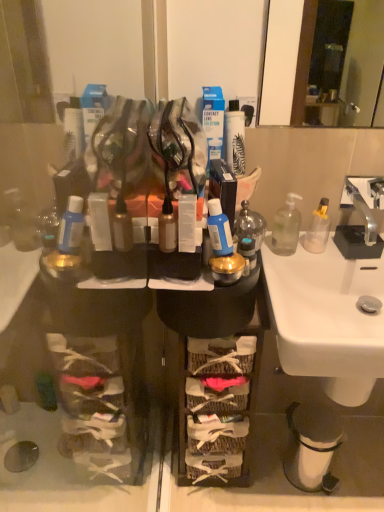
The height and width of the screenshot is (512, 384). What do you see at coordinates (318, 228) in the screenshot?
I see `clear plastic bottle at right, the third bottle positioned from the left` at bounding box center [318, 228].

What is the approximate height of translucent plastic bottle at center, the 3th toiletry in the left-to-right sequence?

The height of translucent plastic bottle at center, the 3th toiletry in the left-to-right sequence, is 7.49 centimeters.

The height and width of the screenshot is (512, 384). Describe the element at coordinates (286, 226) in the screenshot. I see `transparent glass soap dispenser at right, the 2th bottle in the left-to-right sequence` at that location.

The image size is (384, 512). In order to click on transparent glass soap dispenser at right, acting as the 2th bottle starting from the right in this screenshot , I will do `click(286, 226)`.

Image resolution: width=384 pixels, height=512 pixels. What do you see at coordinates (167, 227) in the screenshot?
I see `matte plastic container at center, the third toiletry in the right-to-left sequence` at bounding box center [167, 227].

What do you see at coordinates (362, 212) in the screenshot?
I see `silver metallic faucet at upper right` at bounding box center [362, 212].

Locate an element on the screen. This screenshot has height=512, width=384. clear plastic bottle at right, the 1th bottle from the right is located at coordinates (318, 228).

Between clear plastic bottle at right, the third bottle positioned from the left, and transparent glass soap dispenser at right, acting as the 2th bottle starting from the right, which one has larger width?

With larger width is transparent glass soap dispenser at right, acting as the 2th bottle starting from the right.

Would you say clear plastic bottle at right, the 1th bottle from the right, is outside transparent glass soap dispenser at right, the 2th bottle in the left-to-right sequence?

Yes, clear plastic bottle at right, the 1th bottle from the right, is not within transparent glass soap dispenser at right, the 2th bottle in the left-to-right sequence.

You are a GUI agent. You are given a task and a screenshot of the screen. Output one action in this format:
    pyautogui.click(x=<x>, y=<y>)
    Task: Click on the bottle on the right of transparent glass soap dispenser at right, acting as the 2th bottle starting from the right
    This screenshot has height=512, width=384.
    Given the screenshot: What is the action you would take?
    pyautogui.click(x=318, y=228)

Is blue matte bottle at center, which is counted as the 2th toiletry, starting from the right, a part of clear plastic bottle at right, the third bottle positioned from the left?

No, blue matte bottle at center, which is counted as the 2th toiletry, starting from the right, is located outside of clear plastic bottle at right, the third bottle positioned from the left.

From the image's perspective, is clear plastic bottle at right, the third bottle positioned from the left, below blue matte bottle at center, which is counted as the 2th toiletry, starting from the right?

No, from the image's perspective, clear plastic bottle at right, the third bottle positioned from the left, is not beneath blue matte bottle at center, which is counted as the 2th toiletry, starting from the right.

Is clear plastic bottle at right, the third bottle positioned from the left, in front of or behind blue matte bottle at center, which is counted as the 2th toiletry, starting from the right, in the image?

In the image, clear plastic bottle at right, the third bottle positioned from the left, appears behind blue matte bottle at center, which is counted as the 2th toiletry, starting from the right.

Looking at the image, does matte plastic container at center, arranged as the 1th toiletry when viewed from the left, seem bigger or smaller compared to translucent plastic bottle at center, positioned as the 1th toiletry in right-to-left order?

matte plastic container at center, arranged as the 1th toiletry when viewed from the left, is smaller than translucent plastic bottle at center, positioned as the 1th toiletry in right-to-left order.

In terms of height, does matte plastic container at center, arranged as the 1th toiletry when viewed from the left, look taller or shorter compared to translucent plastic bottle at center, positioned as the 1th toiletry in right-to-left order?

matte plastic container at center, arranged as the 1th toiletry when viewed from the left, is taller than translucent plastic bottle at center, positioned as the 1th toiletry in right-to-left order.

Is the position of matte plastic container at center, arranged as the 1th toiletry when viewed from the left, less distant than that of translucent plastic bottle at center, positioned as the 1th toiletry in right-to-left order?

That is True.

Does point (251, 243) appear closer or farther from the camera than point (355, 296)?

Point (251, 243) appears to be closer to the viewer than point (355, 296).

In terms of width, does translucent plastic bottle at center, the 3th toiletry in the left-to-right sequence, look wider or thinner when compared to white ceramic sink at lower right?

In the image, translucent plastic bottle at center, the 3th toiletry in the left-to-right sequence, appears to be more narrow than white ceramic sink at lower right.

Consider the image. From a real-world perspective, is translucent plastic bottle at center, the 3th toiletry in the left-to-right sequence, physically located above or below white ceramic sink at lower right?

From a real-world perspective, translucent plastic bottle at center, the 3th toiletry in the left-to-right sequence, is physically above white ceramic sink at lower right.

Is matte plastic container at center, the third toiletry in the right-to-left sequence, facing towards blue matte bottle at center, which ranks as the second toiletry in left-to-right order?

No, matte plastic container at center, the third toiletry in the right-to-left sequence, is not oriented towards blue matte bottle at center, which ranks as the second toiletry in left-to-right order.

Are matte plastic container at center, the third toiletry in the right-to-left sequence, and blue matte bottle at center, which ranks as the second toiletry in left-to-right order, making contact?

There is a gap between matte plastic container at center, the third toiletry in the right-to-left sequence, and blue matte bottle at center, which ranks as the second toiletry in left-to-right order.

Is point (165, 246) positioned behind point (208, 207)?

Yes, it is behind point (208, 207).

Is woven baskets at center next to silver metallic faucet at upper right?

No, woven baskets at center is not in contact with silver metallic faucet at upper right.

Based on the photo, is woven baskets at center positioned with its back to silver metallic faucet at upper right?

No.

From a real-world perspective, is woven baskets at center positioned above or below silver metallic faucet at upper right?

From a real-world perspective, woven baskets at center is physically below silver metallic faucet at upper right.

From the image's perspective, is woven baskets at center located above silver metallic faucet at upper right?

Incorrect, from the image's perspective, woven baskets at center is lower than silver metallic faucet at upper right.

Based on the photo, is transparent glass soap dispenser at right, acting as the 2th bottle starting from the right, at the back of translucent plastic bottle at center, the 3th toiletry in the left-to-right sequence?

No, transparent glass soap dispenser at right, acting as the 2th bottle starting from the right, is not at the back of translucent plastic bottle at center, the 3th toiletry in the left-to-right sequence.

Measure the distance from translucent plastic bottle at center, the 3th toiletry in the left-to-right sequence, to transparent glass soap dispenser at right, acting as the 2th bottle starting from the right.

translucent plastic bottle at center, the 3th toiletry in the left-to-right sequence, and transparent glass soap dispenser at right, acting as the 2th bottle starting from the right, are 8.51 inches apart.

Looking at this image, is translucent plastic bottle at center, positioned as the 1th toiletry in right-to-left order, not inside transparent glass soap dispenser at right, acting as the 2th bottle starting from the right?

translucent plastic bottle at center, positioned as the 1th toiletry in right-to-left order, lies outside transparent glass soap dispenser at right, acting as the 2th bottle starting from the right,'s area.

Where is `the 1st bottle below the clear plastic bottle at right, the third bottle positioned from the left (from the image's perspective)`? the 1st bottle below the clear plastic bottle at right, the third bottle positioned from the left (from the image's perspective) is located at coordinates (286, 226).

The image size is (384, 512). Find the location of `the 2nd toiletry to the left of the clear plastic bottle at right, the third bottle positioned from the left, starting your count from the anchor`. the 2nd toiletry to the left of the clear plastic bottle at right, the third bottle positioned from the left, starting your count from the anchor is located at coordinates (219, 229).

Based on their spatial positions, is clear plastic bottle at right, the 1th bottle from the right, or transparent glass soap dispenser at right, the 2th bottle in the left-to-right sequence, closer to white ceramic sink at lower right?

clear plastic bottle at right, the 1th bottle from the right, lies closer to white ceramic sink at lower right than the other object.

From the image, which object appears to be nearer to clear plastic bottle at right, the third bottle positioned from the left, translucent glass bottle at center, the 1th bottle viewed from the left, or woven baskets at center?

The object closer to clear plastic bottle at right, the third bottle positioned from the left, is translucent glass bottle at center, the 1th bottle viewed from the left.

Considering their positions, is silver metallic faucet at upper right positioned further to transparent glass soap dispenser at right, acting as the 2th bottle starting from the right, than woven baskets at center?

woven baskets at center lies further to transparent glass soap dispenser at right, acting as the 2th bottle starting from the right, than the other object.

Which object lies further to the anchor point silver metallic faucet at upper right, white ceramic sink at lower right or woven baskets at center?

woven baskets at center.

When comparing their distances from clear plastic bottle at right, the third bottle positioned from the left, does transparent glass soap dispenser at right, acting as the 2th bottle starting from the right, or blue matte bottle at center, which is counted as the 2th toiletry, starting from the right, seem further?

Among the two, blue matte bottle at center, which is counted as the 2th toiletry, starting from the right, is located further to clear plastic bottle at right, the third bottle positioned from the left.

Estimate the real-world distances between objects in this image. Which object is closer to transparent glass soap dispenser at right, the 2th bottle in the left-to-right sequence, translucent plastic bottle at center, the 3th toiletry in the left-to-right sequence, or matte plastic container at center, the third toiletry in the right-to-left sequence?

Among the two, translucent plastic bottle at center, the 3th toiletry in the left-to-right sequence, is located nearer to transparent glass soap dispenser at right, the 2th bottle in the left-to-right sequence.

Looking at the image, which one is located closer to translucent glass bottle at center, the 1th bottle viewed from the left, translucent plastic bottle at center, positioned as the 1th toiletry in right-to-left order, or blue matte bottle at center, which ranks as the second toiletry in left-to-right order?

The object closer to translucent glass bottle at center, the 1th bottle viewed from the left, is translucent plastic bottle at center, positioned as the 1th toiletry in right-to-left order.

In the scene shown: Estimate the real-world distances between objects in this image. Which object is closer to translucent glass bottle at center, acting as the third bottle starting from the right, blue matte bottle at center, which is counted as the 2th toiletry, starting from the right, or translucent plastic bottle at center, the 3th toiletry in the left-to-right sequence?

translucent plastic bottle at center, the 3th toiletry in the left-to-right sequence.

Where is `sink that lies between translucent plastic bottle at center, the 3th toiletry in the left-to-right sequence, and woven baskets at center from top to bottom`? The height and width of the screenshot is (512, 384). sink that lies between translucent plastic bottle at center, the 3th toiletry in the left-to-right sequence, and woven baskets at center from top to bottom is located at coordinates (330, 313).

Where is `bottle between transparent glass soap dispenser at right, the 2th bottle in the left-to-right sequence, and woven baskets at center in the up-down direction`? The width and height of the screenshot is (384, 512). bottle between transparent glass soap dispenser at right, the 2th bottle in the left-to-right sequence, and woven baskets at center in the up-down direction is located at coordinates (250, 225).

The width and height of the screenshot is (384, 512). I want to click on toiletry located between matte plastic container at center, arranged as the 1th toiletry when viewed from the left, and translucent plastic bottle at center, the 3th toiletry in the left-to-right sequence, in the left-right direction, so click(x=219, y=229).

In order to click on sink between transparent glass soap dispenser at right, the 2th bottle in the left-to-right sequence, and woven baskets at center in the up-down direction in this screenshot , I will do `click(330, 313)`.